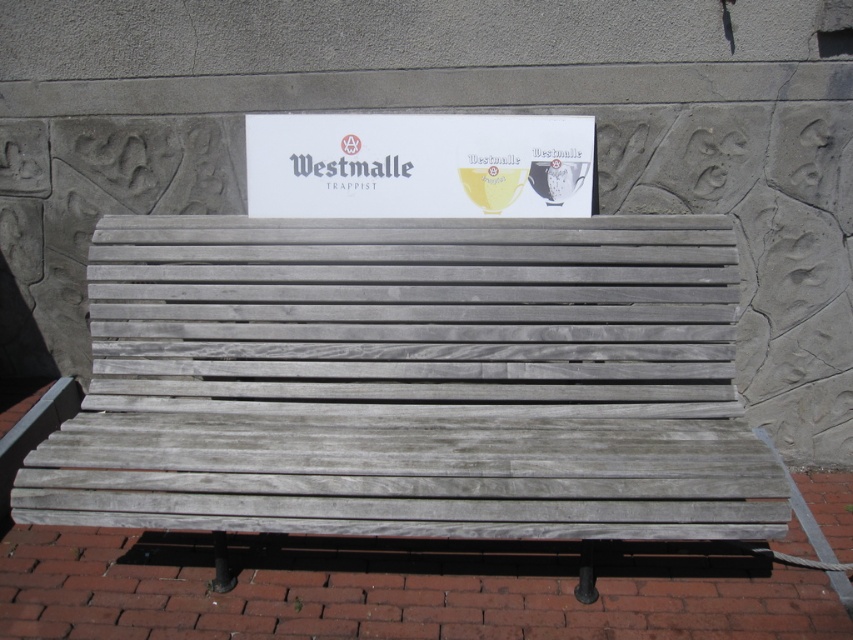
You are standing in front of the bench and want to place a small potted plant exactly at the point marked by coordinates point (x=410, y=381). What object will the plant be placed on?

The point (x=410, y=381) corresponds to the weathered wood bench at center, so the plant will be placed on the weathered wood bench at center.

You are a painter standing at the base of the weathered wood bench at center and the white paper sign at center. You need to paint both items. Which one will require you to reach higher?

The weathered wood bench at center has a greater height compared to the white paper sign at center, so you will need to reach higher to paint the weathered wood bench at center.

From the picture: You are standing in front of the bench and want to touch both the weathered wood bench at center and the white paper sign at center. Which object will you need to reach out further to touch?

The white paper sign at center is further away from you than the weathered wood bench at center, so you will need to reach out further to touch the white paper sign at center.